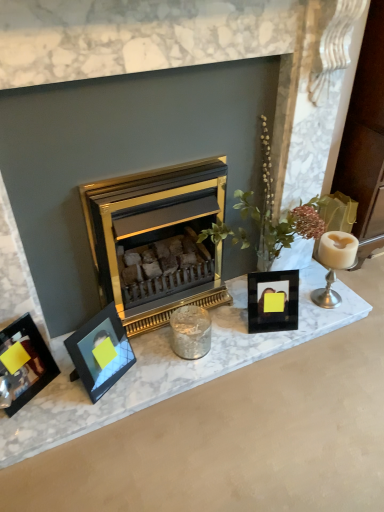
Question: From a real-world perspective, is gold metallic fireplace at center positioned over black glass photo frame at center, which is the first picture frame from right to left, based on gravity?

Choices:
 (A) yes
 (B) no

Answer: (A)

Question: Considering the relative sizes of gold metallic fireplace at center and black glass photo frame at center, which is the first picture frame from right to left, in the image provided, is gold metallic fireplace at center shorter than black glass photo frame at center, which is the first picture frame from right to left,?

Choices:
 (A) yes
 (B) no

Answer: (B)

Question: Is black glass photo frame at center, which is the first picture frame from right to left, surrounded by gold metallic fireplace at center?

Choices:
 (A) yes
 (B) no

Answer: (B)

Question: Is gold metallic fireplace at center turned away from black glass photo frame at center, which ranks as the third picture frame in left-to-right order?

Choices:
 (A) no
 (B) yes

Answer: (B)

Question: Does gold metallic fireplace at center appear on the left side of black glass photo frame at center, which ranks as the third picture frame in left-to-right order?

Choices:
 (A) yes
 (B) no

Answer: (A)

Question: Does gold metallic fireplace at center have a lesser width compared to black glass photo frame at center, which is the first picture frame from right to left?

Choices:
 (A) no
 (B) yes

Answer: (A)

Question: Does metallic silver photo frame at left, which appears as the 1th picture frame when viewed from the left, come behind white glossy candle holder at right, which appears as the second candle holder when viewed from the left?

Choices:
 (A) no
 (B) yes

Answer: (A)

Question: Considering the relative sizes of metallic silver photo frame at left, which is counted as the 3th picture frame, starting from the right, and white glossy candle holder at right, which appears as the second candle holder when viewed from the left, in the image provided, is metallic silver photo frame at left, which is counted as the 3th picture frame, starting from the right, wider than white glossy candle holder at right, which appears as the second candle holder when viewed from the left,?

Choices:
 (A) yes
 (B) no

Answer: (B)

Question: From the image's perspective, does metallic silver photo frame at left, which appears as the 1th picture frame when viewed from the left, appear higher than white glossy candle holder at right, which appears as the second candle holder when viewed from the left?

Choices:
 (A) yes
 (B) no

Answer: (B)

Question: Can you confirm if metallic silver photo frame at left, which appears as the 1th picture frame when viewed from the left, is bigger than white glossy candle holder at right, which appears as the second candle holder when viewed from the left?

Choices:
 (A) no
 (B) yes

Answer: (B)

Question: Is metallic silver photo frame at left, which appears as the 1th picture frame when viewed from the left, not close to white glossy candle holder at right, which appears as the second candle holder when viewed from the left?

Choices:
 (A) yes
 (B) no

Answer: (A)

Question: From the image's perspective, is metallic silver photo frame at left, which appears as the 1th picture frame when viewed from the left, under white glossy candle holder at right, which is the first candle holder from right to left?

Choices:
 (A) yes
 (B) no

Answer: (A)

Question: Does gold metallic fireplace at center have a smaller size compared to white glossy candle holder at right, which is the first candle holder from right to left?

Choices:
 (A) yes
 (B) no

Answer: (B)